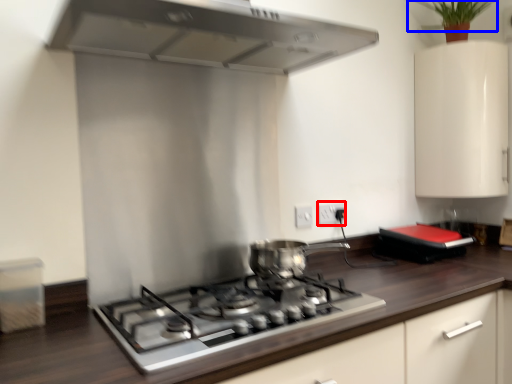
Question: Which object appears closest to the camera in this image, electric outlet (highlighted by a red box) or plant (highlighted by a blue box)?

Choices:
 (A) electric outlet
 (B) plant

Answer: (B)